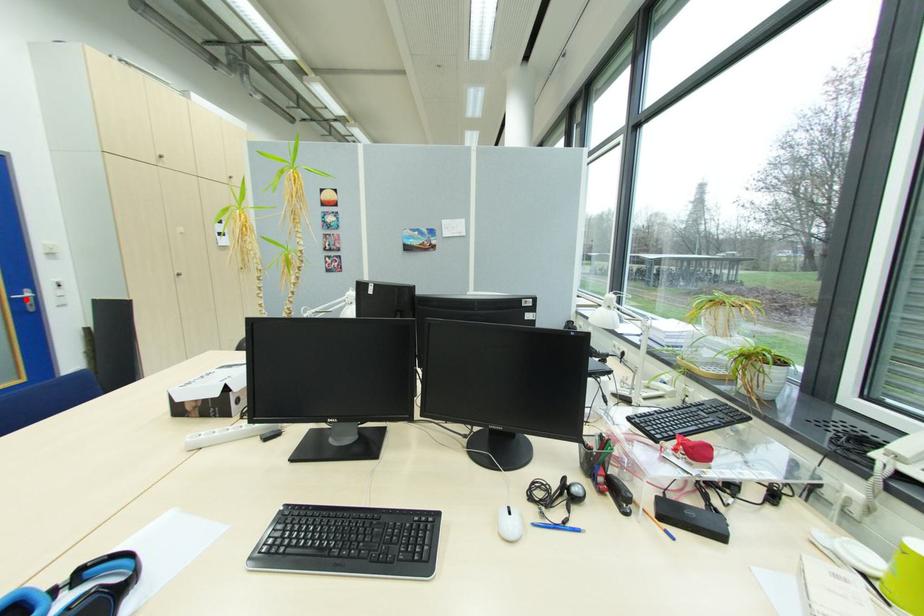
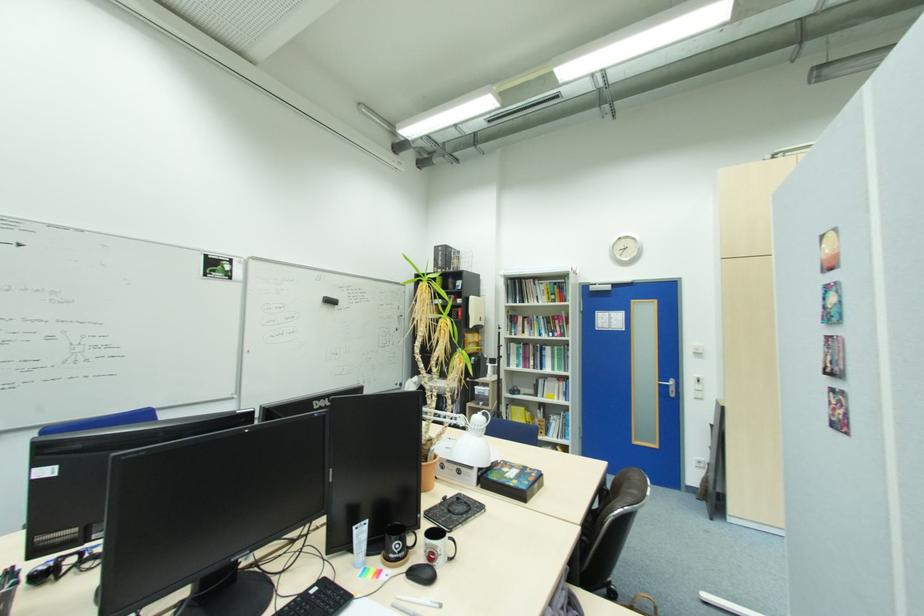
Question: I am providing you with two images of the same scene from different viewpoints. Given a red point in image1, look at the same physical point in image2. Is it:

Choices:
 (A) Closer to the viewpoint
 (B) Farther from the viewpoint

Answer: (A)